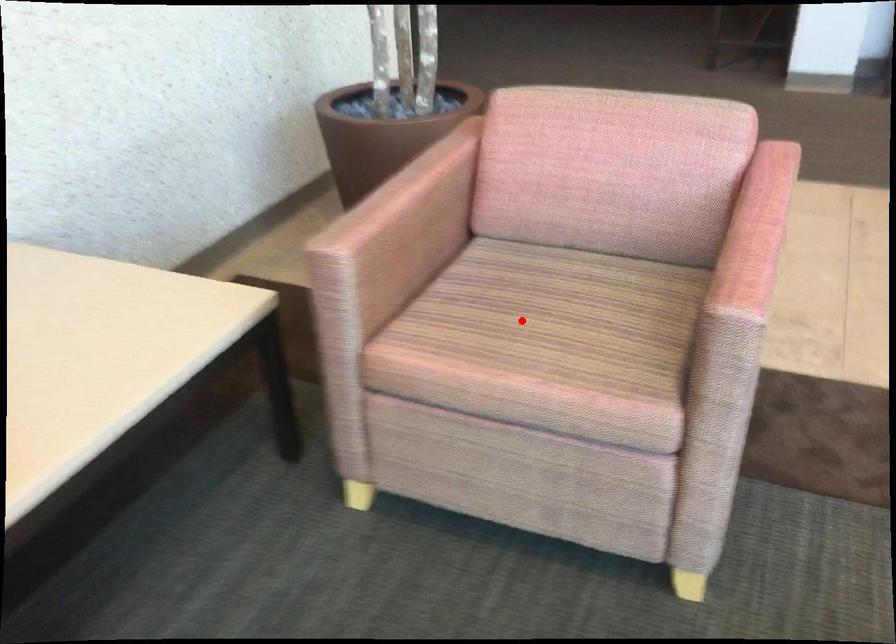
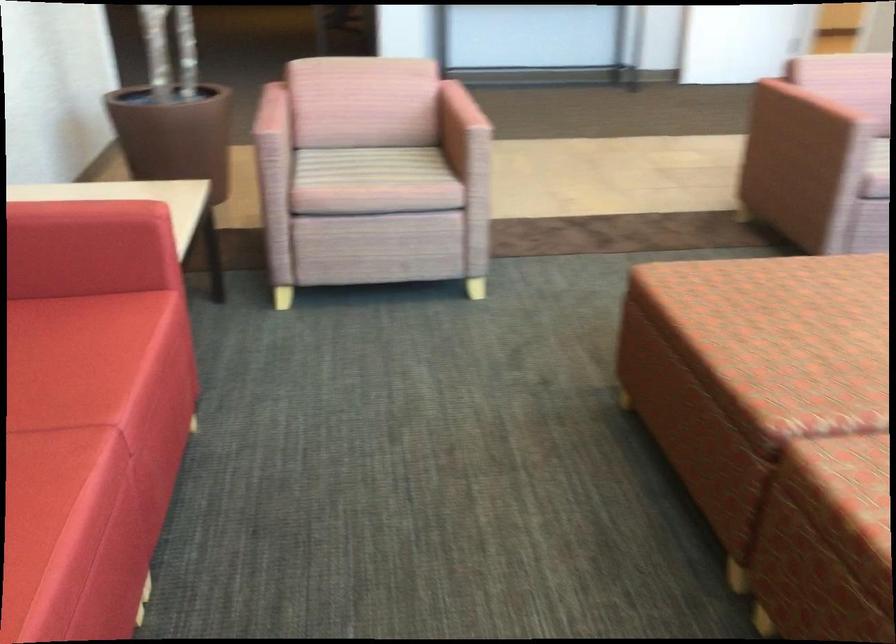
Question: I am providing you with two images of the same scene from different viewpoints. In image1, a red point is highlighted. Considering the same 3D point in image2, which of the following is correct?

Choices:
 (A) It is closer
 (B) It is farther

Answer: (B)